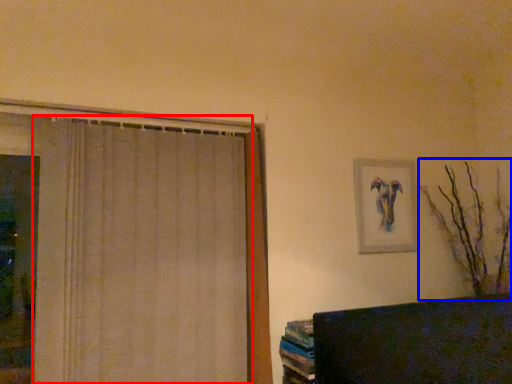
Question: Which object appears closest to the camera in this image, curtain (highlighted by a red box) or branch (highlighted by a blue box)?

Choices:
 (A) curtain
 (B) branch

Answer: (A)